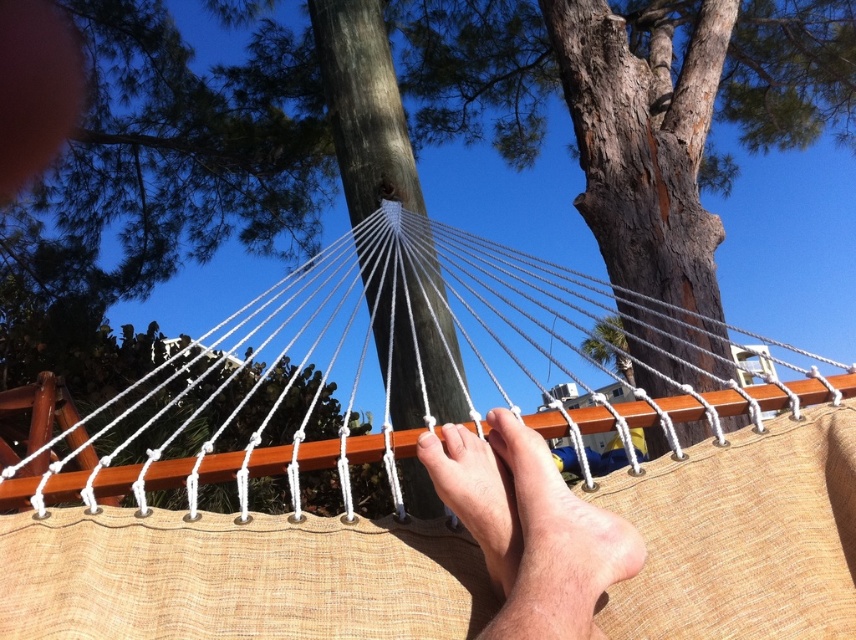
Question: Which of the following is the closest to the observer?

Choices:
 (A) (203, 403)
 (B) (444, 452)

Answer: (B)

Question: From the image, what is the correct spatial relationship of white rope at center in relation to light brown textured foot at center?

Choices:
 (A) left
 (B) right

Answer: (A)

Question: Which object appears farthest from the camera in this image?

Choices:
 (A) white rope at center
 (B) light brown textured foot at center

Answer: (A)

Question: Is the position of white rope at center less distant than that of light brown textured foot at center?

Choices:
 (A) no
 (B) yes

Answer: (A)

Question: In this image, where is white rope at center located relative to light brown textured foot at center?

Choices:
 (A) right
 (B) left

Answer: (B)

Question: Among these points, which one is farthest from the camera?

Choices:
 (A) (541, 531)
 (B) (651, 396)

Answer: (B)